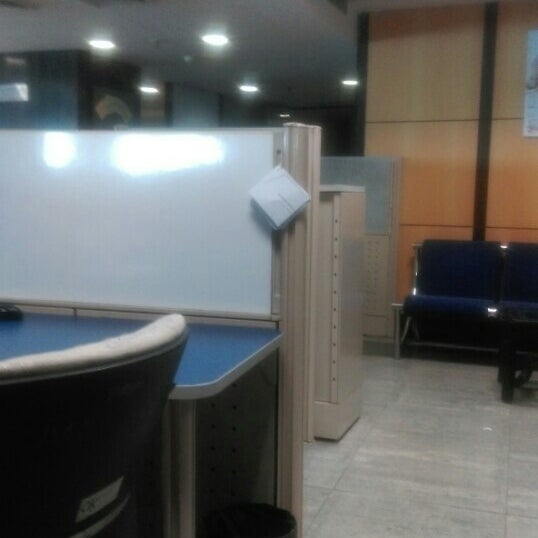
Identify the location of tile floor. The width and height of the screenshot is (538, 538). coord(399,461).